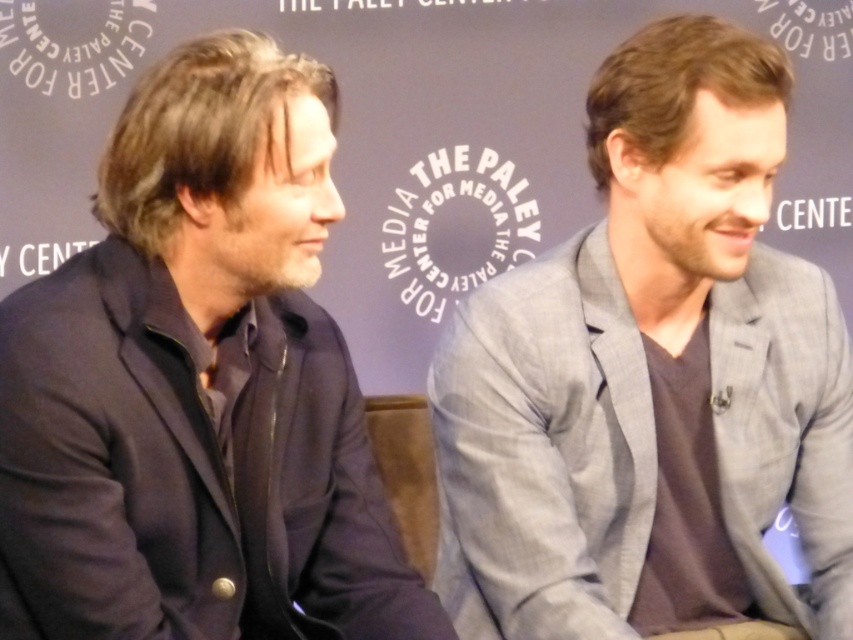
In the image of the Paley Center for Media event, there are two individuals seated side by side. The one on the left wears a dark blazer over a collared shirt, and the one on the right has a light gray blazer. Where is the point at coordinates (651, 378) located in relation to the two people?

The point at coordinates (651, 378) corresponds to the gray textured blazer at center, which belongs to the individual on the right wearing the light gray blazer.

In the scene shown: You are standing at the Paley Center for Media event and want to take a photo of the two individuals seated at the panel discussion. The camera you have can only focus on objects within 5 feet. Is the point at coordinates point (467,476) within the camera focus range?

The distance between point (467,476) and the viewer is 4.74 feet, which is within the camera focus range of 5 feet. Therefore, the camera can focus on that point.